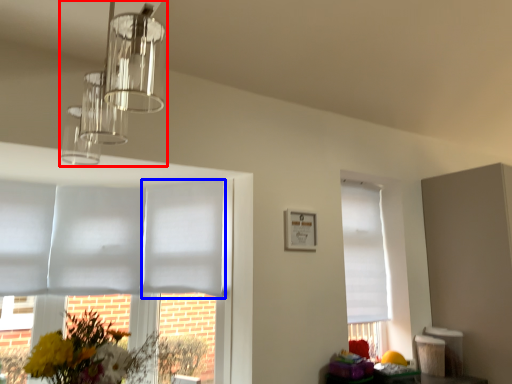
Question: Which object is further to the camera taking this photo, lamp (highlighted by a red box) or blind (highlighted by a blue box)?

Choices:
 (A) lamp
 (B) blind

Answer: (B)